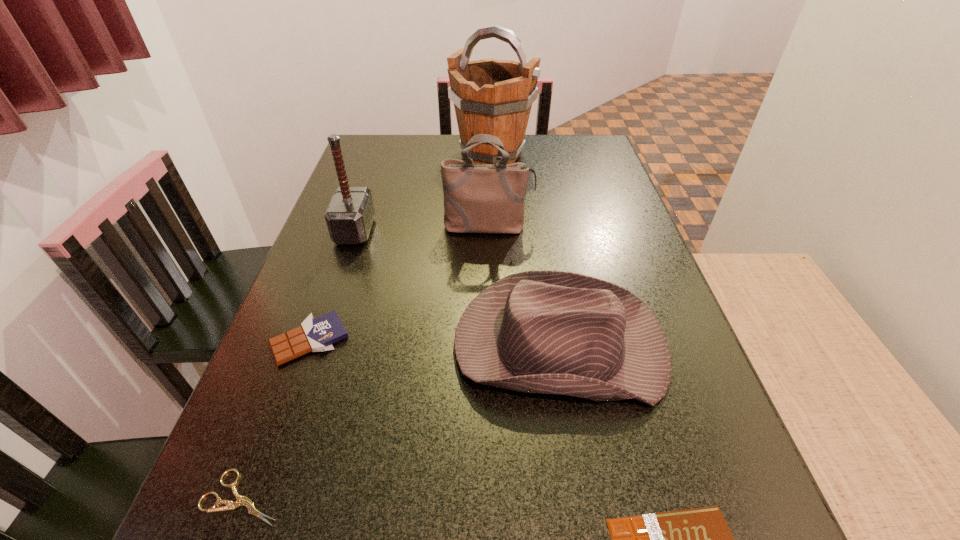
Identify the location of bucket. (490, 96).

Identify the location of the tallest object. (490, 96).

This screenshot has height=540, width=960. In order to click on shoulder bag in this screenshot , I will do `click(478, 198)`.

Identify the location of hammer. This screenshot has height=540, width=960. (349, 217).

In order to click on fedora in this screenshot , I will do click(x=550, y=332).

The width and height of the screenshot is (960, 540). Identify the location of the farther chocolate bar. (318, 334).

What are the coordinates of `the third shortest object` in the screenshot? It's located at [318, 334].

This screenshot has width=960, height=540. I want to click on shears, so click(240, 500).

Find the location of a particular element. The image size is (960, 540). free location located on the front of the bucket is located at coordinates (494, 221).

Find the location of a particular element. vacant space located on the front-facing side of the shoulder bag is located at coordinates (491, 313).